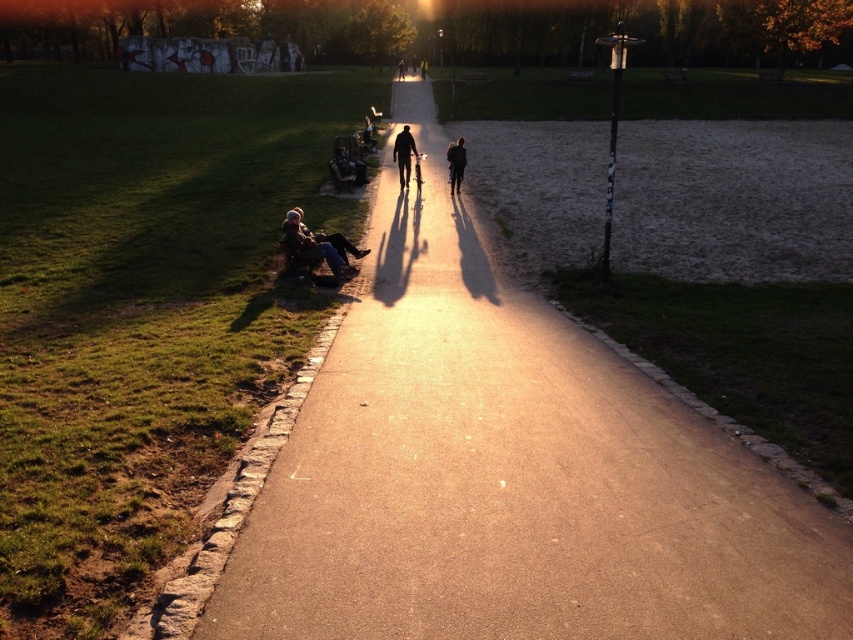
Question: Which of these objects is positioned closest to the dark brown leather jacket at lower left?

Choices:
 (A) dark brown leather jacket at center
 (B) dark blue jeans at center

Answer: (B)

Question: Is dark blue jeans at center to the right of dark brown leather jacket at center from the viewer's perspective?

Choices:
 (A) no
 (B) yes

Answer: (A)

Question: Which is nearer to the smooth asphalt path at center?

Choices:
 (A) dark brown leather jacket at lower left
 (B) dark brown leather jacket at center

Answer: (A)

Question: Which point is farther from the camera taking this photo?

Choices:
 (A) (572, 458)
 (B) (299, 250)

Answer: (B)

Question: Does dark brown leather jacket at lower left appear on the left side of dark brown leather jacket at center?

Choices:
 (A) no
 (B) yes

Answer: (B)

Question: Does dark brown leather jacket at lower left have a larger size compared to dark blue jeans at center?

Choices:
 (A) yes
 (B) no

Answer: (B)